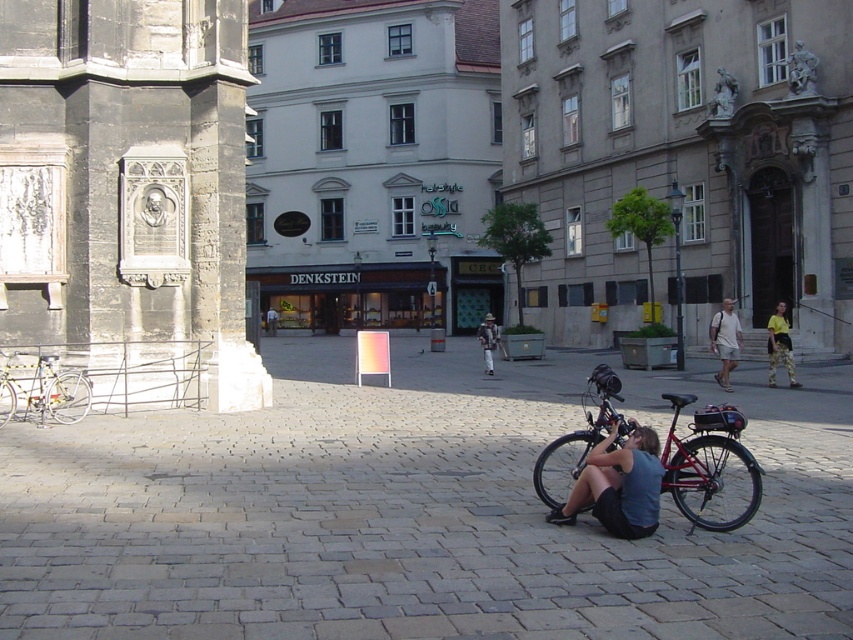
Question: Observing the image, what is the correct spatial positioning of shiny red bicycle at lower right in reference to light brown shorts at center?

Choices:
 (A) right
 (B) left

Answer: (B)

Question: Which of the following is the closest to the observer?

Choices:
 (A) light brown shorts at center
 (B) shiny red bicycle at lower right

Answer: (B)

Question: Among these points, which one is farthest from the camera?

Choices:
 (A) (683, 461)
 (B) (639, 515)

Answer: (A)

Question: Observing the image, what is the correct spatial positioning of metallic bicycle at center in reference to light brown shorts at center?

Choices:
 (A) below
 (B) above

Answer: (A)

Question: Is shiny red bicycle at lower right to the right of light brown shorts at center from the viewer's perspective?

Choices:
 (A) yes
 (B) no

Answer: (B)

Question: Which is nearer to the yellow camouflage pants at right?

Choices:
 (A) light brown shorts at center
 (B) shiny red bicycle at lower right
 (C) silver metallic bicycle at left

Answer: (A)